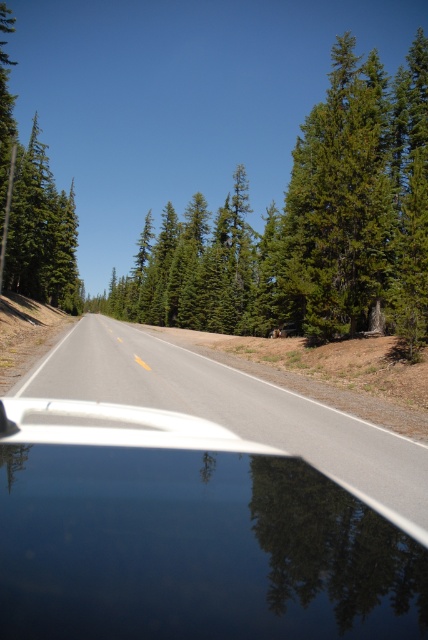
You are driving a car with a width of 2 meters. The car is positioned on the asphalt road at center. Can you safely drive through the road without touching the green matte tree at left?

The asphalt road at center is narrower than the green matte tree at left. Since the road is only 2 meters wide, the car can drive through but must stay centered to avoid the tree.

Based on the photo, you are driving a car and want to know the relative positions of the asphalt road at center and the green matte tree at left in the scene. Which object is located to the right of the other?

The asphalt road at center is positioned on the right side of green matte tree at left, so the asphalt road at center is to the right of the green matte tree at left.